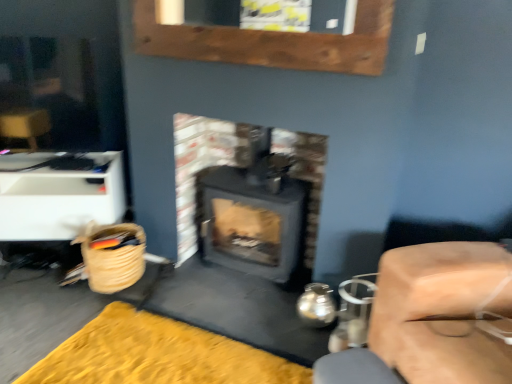
Where is `blank space situated above woven straw basket at lower left (from a real-world perspective)`? blank space situated above woven straw basket at lower left (from a real-world perspective) is located at coordinates (109, 232).